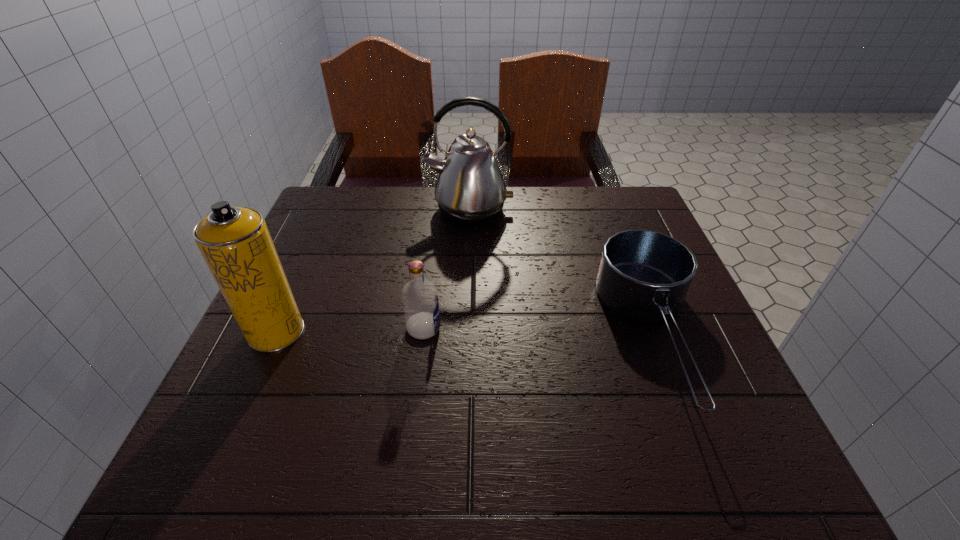
In order to click on free point that satisfies the following two spatial constraints: 1. from the spout of the kettle; 2. on the label of the vodka in this screenshot , I will do `click(465, 328)`.

In order to click on vacant space that satisfies the following two spatial constraints: 1. from the spout of the farthest object; 2. on the label of the vodka in this screenshot , I will do `click(465, 328)`.

Image resolution: width=960 pixels, height=540 pixels. What are the coordinates of `vacant space that satisfies the following two spatial constraints: 1. from the spout of the kettle; 2. on the label of the vodka` in the screenshot? It's located at (465, 328).

The image size is (960, 540). Find the location of `free space that satisfies the following two spatial constraints: 1. on the label of the vodka; 2. on the front side of the leftmost object`. free space that satisfies the following two spatial constraints: 1. on the label of the vodka; 2. on the front side of the leftmost object is located at coordinates (423, 332).